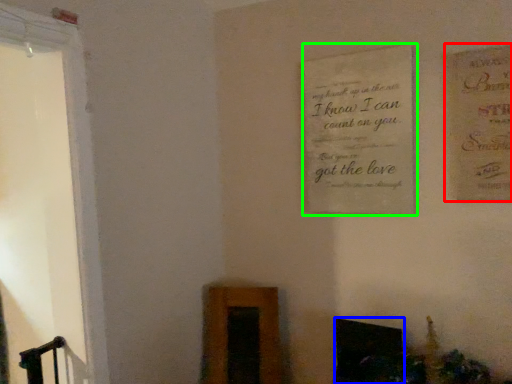
Question: Considering the real-world distances, which object is closest to postcard (highlighted by a red box)? fireplace (highlighted by a blue box) or plaque (highlighted by a green box).

Choices:
 (A) fireplace
 (B) plaque

Answer: (B)